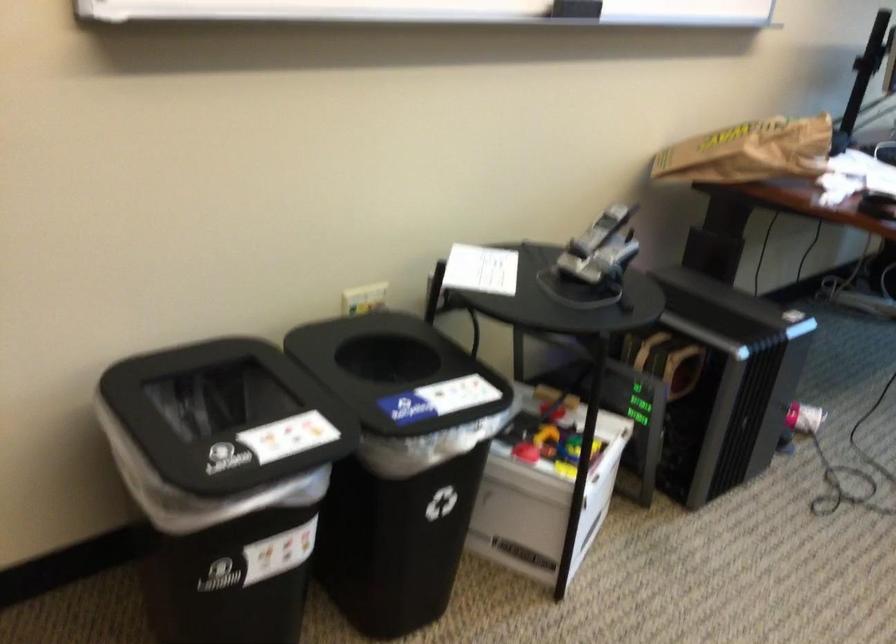
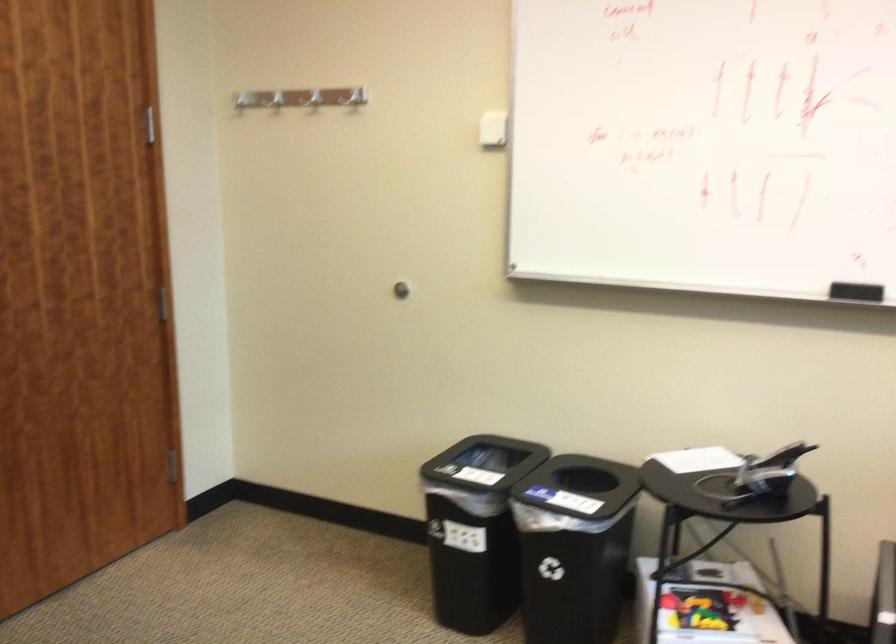
Find the pixel in the second image that matches (564,437) in the first image.

(701, 609)